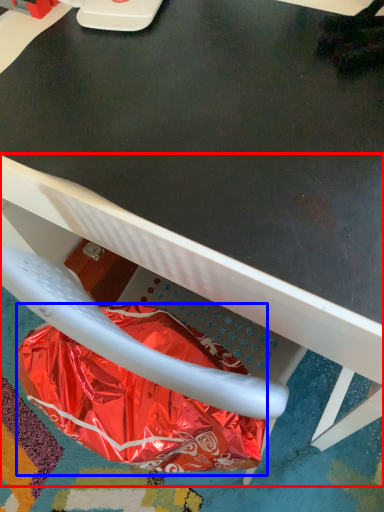
Question: Which point is further to the camera, chair (highlighted by a red box) or paper bag (highlighted by a blue box)?

Choices:
 (A) chair
 (B) paper bag

Answer: (B)